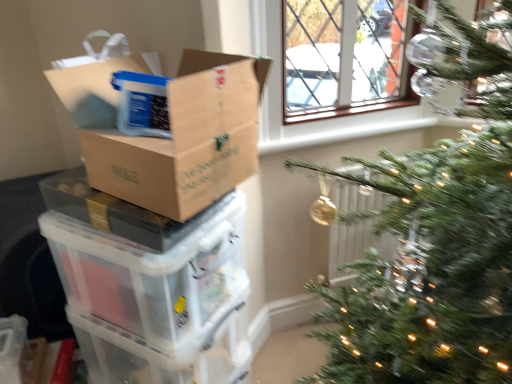
Question: Could transparent plastic storage box at lower left be considered to be inside white plastic radiator at center-right?

Choices:
 (A) no
 (B) yes

Answer: (A)

Question: Is white plastic radiator at center-right bigger than transparent plastic storage box at lower left?

Choices:
 (A) no
 (B) yes

Answer: (A)

Question: Is white plastic radiator at center-right facing away from transparent plastic storage box at lower left?

Choices:
 (A) no
 (B) yes

Answer: (A)

Question: Considering the relative sizes of white plastic radiator at center-right and transparent plastic storage box at lower left in the image provided, is white plastic radiator at center-right wider than transparent plastic storage box at lower left?

Choices:
 (A) yes
 (B) no

Answer: (B)

Question: Considering the relative sizes of white plastic radiator at center-right and transparent plastic storage box at lower left in the image provided, is white plastic radiator at center-right smaller than transparent plastic storage box at lower left?

Choices:
 (A) no
 (B) yes

Answer: (B)

Question: From the image's perspective, is white plastic radiator at center-right located beneath transparent plastic storage box at lower left?

Choices:
 (A) yes
 (B) no

Answer: (B)

Question: Can you confirm if transparent plastic storage box at lower left is bigger than translucent plastic storage box at left?

Choices:
 (A) no
 (B) yes

Answer: (A)

Question: Is the depth of transparent plastic storage box at lower left greater than that of translucent plastic storage box at left?

Choices:
 (A) yes
 (B) no

Answer: (A)

Question: From the image's perspective, is transparent plastic storage box at lower left on top of translucent plastic storage box at left?

Choices:
 (A) no
 (B) yes

Answer: (A)

Question: Can you confirm if transparent plastic storage box at lower left is wider than translucent plastic storage box at left?

Choices:
 (A) yes
 (B) no

Answer: (B)

Question: Can you confirm if transparent plastic storage box at lower left is thinner than translucent plastic storage box at left?

Choices:
 (A) no
 (B) yes

Answer: (B)

Question: Considering the relative sizes of transparent plastic storage box at lower left and translucent plastic storage box at left in the image provided, is transparent plastic storage box at lower left taller than translucent plastic storage box at left?

Choices:
 (A) yes
 (B) no

Answer: (A)

Question: Can you confirm if transparent plastic storage box at lower left is shorter than white plastic radiator at center-right?

Choices:
 (A) yes
 (B) no

Answer: (A)